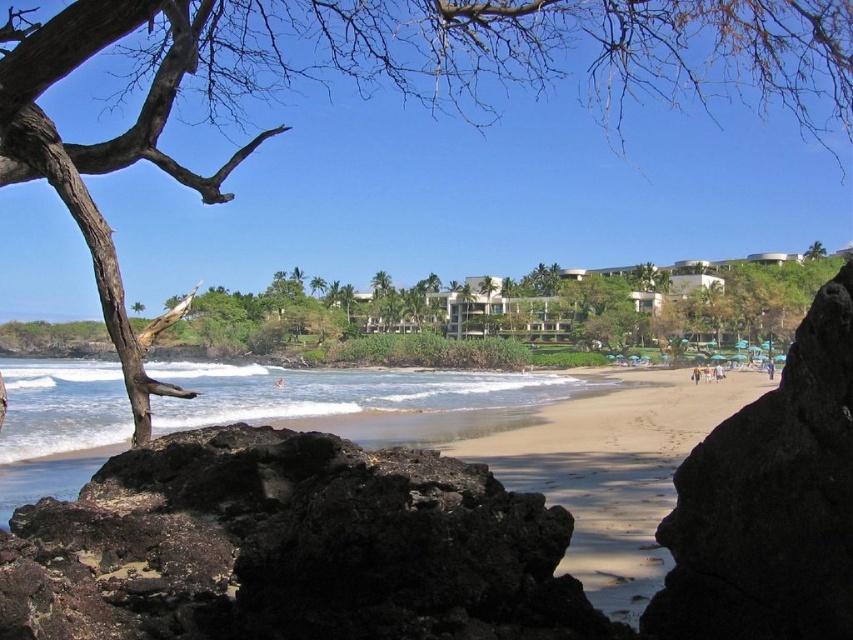
You are a photographer standing on the beach and want to capture both the dark volcanic rock at lower left and the white sand at lower center in the same frame. Based on their positions, which object should you focus on first to ensure both are in the shot?

The dark volcanic rock at lower left is located above the white sand at lower center, so you should focus on the dark volcanic rock at lower left first to ensure both are in the shot.